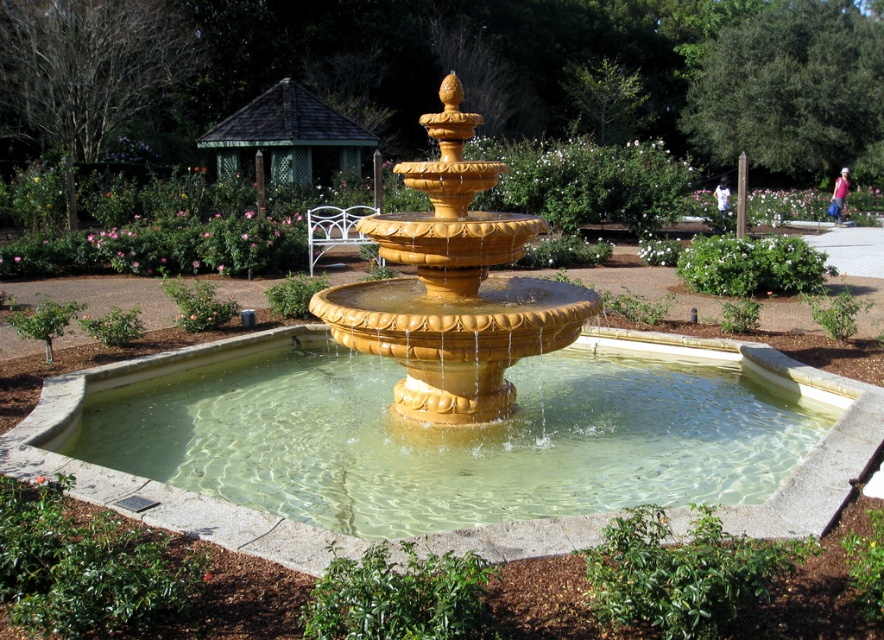
You are standing in the garden and want to take a photo of both the golden fountain and the gazebo. You notice two points marked in the scene, point (412, 417) and point (301, 120). Which point should you stand closer to in order to ensure both the golden fountain and the gazebo are in frame?

You should stand closer to point (412, 417) because it is closer to the camera, allowing you to capture both the golden fountain and the gazebo in the frame.

You are standing in the garden and want to take a photo of both the golden polished stone fountain at center and the green wooden gazebo at upper center. Which object should you position closer to the left side of your camera frame to include both in the shot?

The green wooden gazebo at upper center should be positioned closer to the left side of your camera frame because the golden polished stone fountain at center is to the right of it.